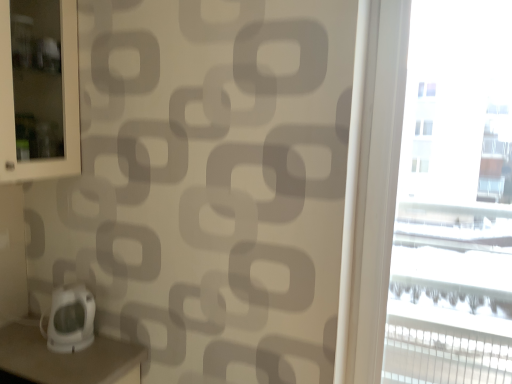
Question: Is white glossy scale at lower left outside of transparent glass window at right?

Choices:
 (A) yes
 (B) no

Answer: (A)

Question: Can you confirm if white glossy scale at lower left is shorter than transparent glass window at right?

Choices:
 (A) yes
 (B) no

Answer: (A)

Question: Does white glossy scale at lower left turn towards transparent glass window at right?

Choices:
 (A) yes
 (B) no

Answer: (A)

Question: Is white glossy scale at lower left far away from transparent glass window at right?

Choices:
 (A) no
 (B) yes

Answer: (B)

Question: Does white glossy scale at lower left have a smaller size compared to transparent glass window at right?

Choices:
 (A) no
 (B) yes

Answer: (B)

Question: Is white glossy scale at lower left to the right of transparent glass window at right from the viewer's perspective?

Choices:
 (A) no
 (B) yes

Answer: (A)

Question: From the image's perspective, is transparent glass window at right located beneath white glossy scale at lower left?

Choices:
 (A) yes
 (B) no

Answer: (B)

Question: Can you confirm if transparent glass window at right is positioned to the left of white glossy scale at lower left?

Choices:
 (A) yes
 (B) no

Answer: (B)

Question: Is transparent glass window at right taller than white glossy scale at lower left?

Choices:
 (A) no
 (B) yes

Answer: (B)

Question: Is transparent glass window at right surrounding white glossy scale at lower left?

Choices:
 (A) yes
 (B) no

Answer: (B)

Question: Can you confirm if transparent glass window at right is bigger than white glossy scale at lower left?

Choices:
 (A) yes
 (B) no

Answer: (A)

Question: From a real-world perspective, is transparent glass window at right over white glossy scale at lower left?

Choices:
 (A) no
 (B) yes

Answer: (B)

Question: Considering the positions of transparent glass window at right and white glossy scale at lower left in the image, is transparent glass window at right wider or thinner than white glossy scale at lower left?

Choices:
 (A) wide
 (B) thin

Answer: (B)